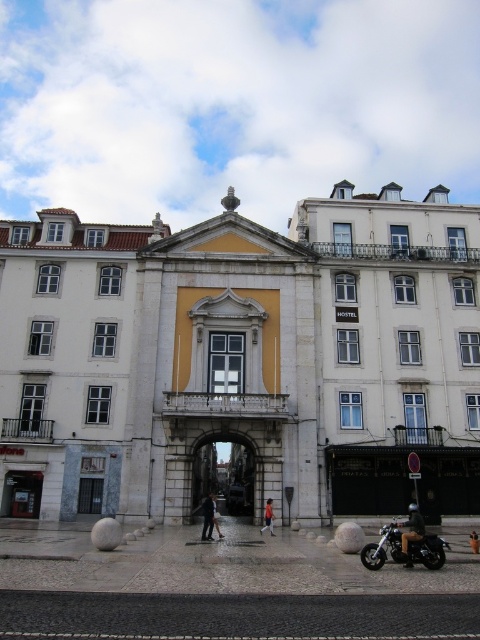
Between dark gray stone archway at center and orange fabric jacket at center, which one appears on the left side from the viewer's perspective?

dark gray stone archway at center is more to the left.

Which is behind, point (236, 461) or point (273, 522)?

The point (236, 461) is more distant.

Image resolution: width=480 pixels, height=640 pixels. Find the location of `dark gray stone archway at center`. dark gray stone archway at center is located at coordinates (226, 477).

You are a GUI agent. You are given a task and a screenshot of the screen. Output one action in this format:
    pyautogui.click(x=<x>, y=<y>)
    Task: Click on the shiny black motorcycle at lower right
    
    Given the screenshot: What is the action you would take?
    pyautogui.click(x=406, y=545)

Is shiny black motorcycle at lower right closer to the viewer compared to dark gray fabric jacket at center?

Yes, shiny black motorcycle at lower right is closer to the viewer.

Locate an element on the screen. The width and height of the screenshot is (480, 640). shiny black motorcycle at lower right is located at coordinates (406, 545).

Can you confirm if dark gray stone archway at center is thinner than shiny black motorcycle at lower right?

Correct, dark gray stone archway at center's width is less than shiny black motorcycle at lower right's.

Is dark gray stone archway at center positioned at the back of shiny black motorcycle at lower right?

That is True.

What are the coordinates of `dark gray stone archway at center` in the screenshot? It's located at (226, 477).